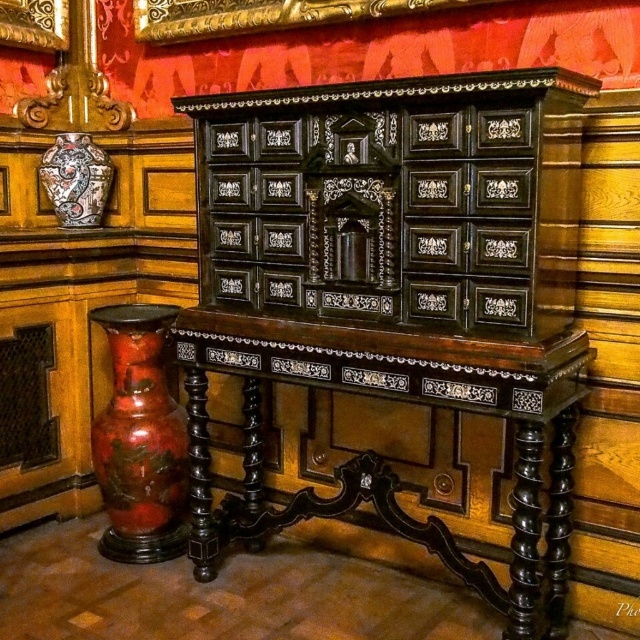
You are an interior designer arranging items in the scene. You need to place a new item between the rustic terracotta vase at left and the gold ornate picture frame at upper center. Where should you position it vertically?

The rustic terracotta vase at left is located below the gold ornate picture frame at upper center, so you should position the new item between them vertically, placing it above the rustic terracotta vase at left and below the gold ornate picture frame at upper center.

You are an interior designer assessing the placement of items in this grand room. The rustic terracotta vase at left and the gold ornate picture frame at upper center are both part of the decor. Which object is taller?

The rustic terracotta vase at left is taller than the gold ornate picture frame at upper center according to the description.

In the scene shown: You are a guest in this room and want to place a small gift on the table. However, you notice the decorative ceramic vase at left might be blocking the black polished wood table at center. Is there space available on the table?

The black polished wood table at center is positioned under the decorative ceramic vase at left, which means the vase is above the table. Therefore, there is space available on the table to place the gift.